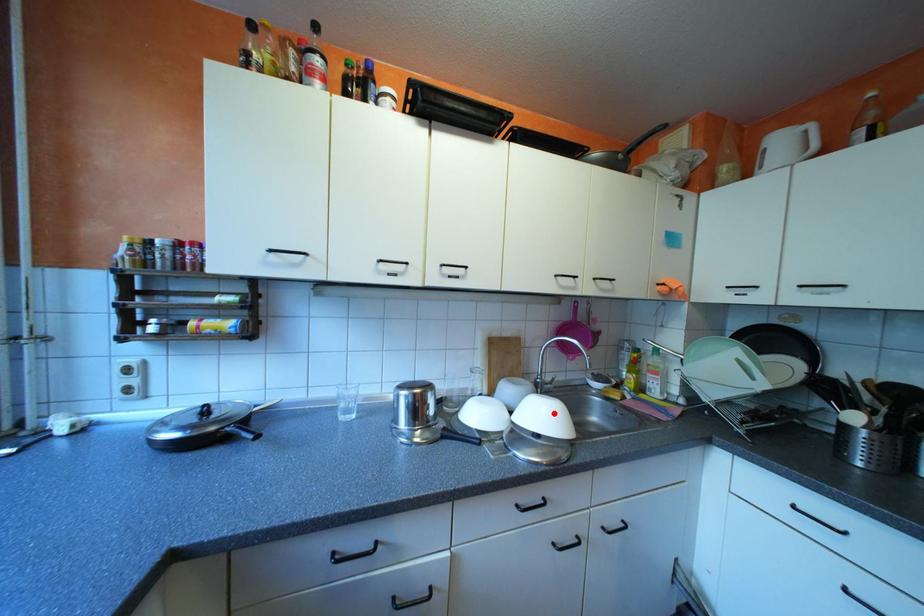
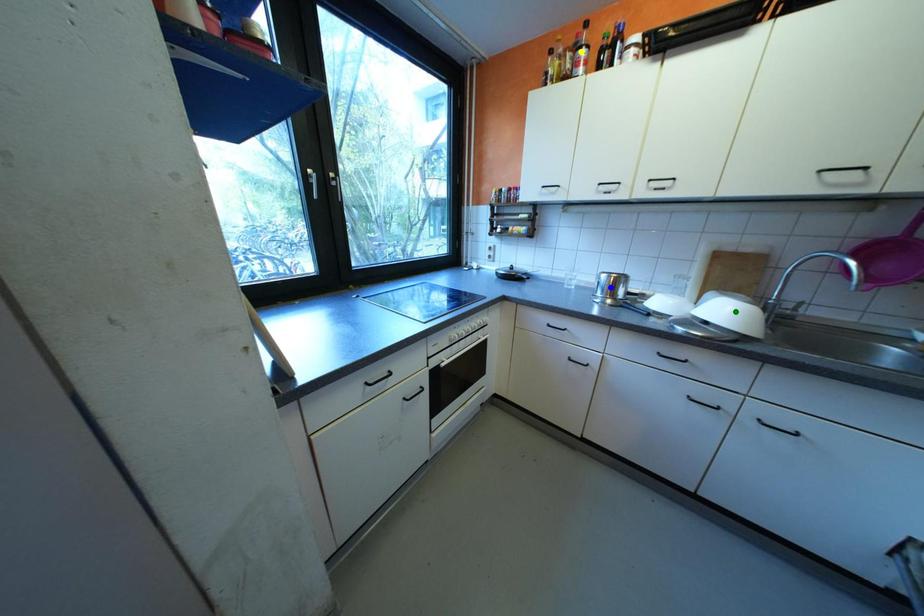
Question: I am providing you with two images of the same scene from different viewpoints. A red point is marked on the first image. You are given multiple points on the second image. Which point in image 2 is actually the same real-world point as the red point in image 1?

Choices:
 (A) green point
 (B) blue point
 (C) yellow point

Answer: (A)